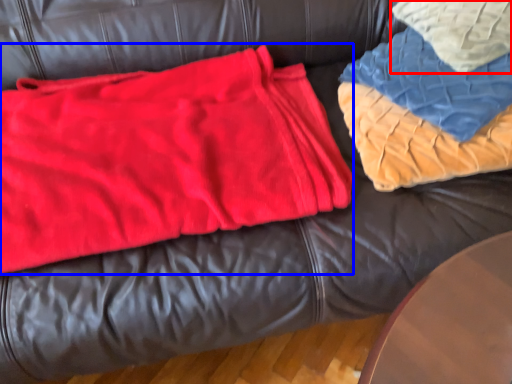
Question: Which object is further to the camera taking this photo, throw pillow (highlighted by a red box) or bean bag chair (highlighted by a blue box)?

Choices:
 (A) throw pillow
 (B) bean bag chair

Answer: (A)